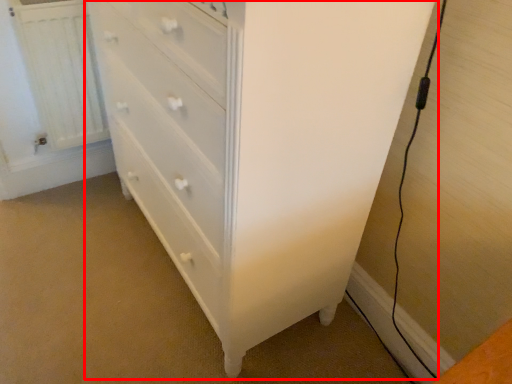
Question: From the image's perspective, where is chest of drawers (annotated by the red box) located in relation to radiator in the image?

Choices:
 (A) below
 (B) above

Answer: (A)